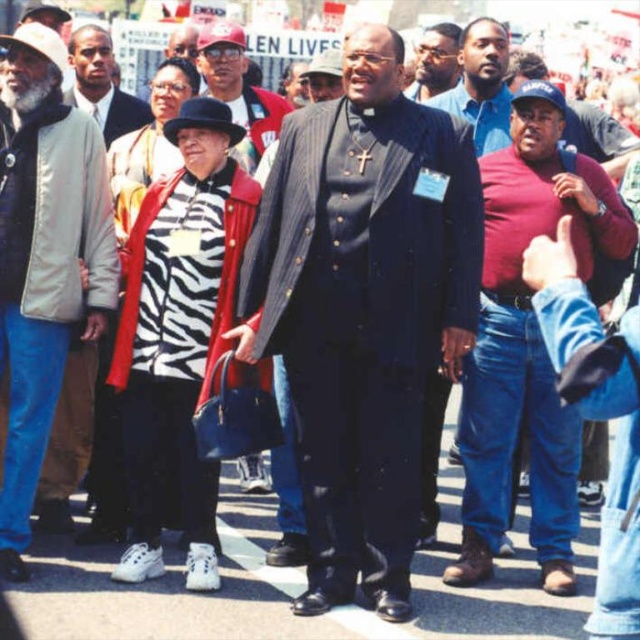
Between matte red shirt at center and light gray jacket at left, which one has less height?

matte red shirt at center

Is matte red shirt at center above light gray jacket at left?

Incorrect, matte red shirt at center is not positioned above light gray jacket at left.

Find the location of a particular element. The width and height of the screenshot is (640, 640). matte red shirt at center is located at coordinates (525, 340).

Can you confirm if matte black suit at center is smaller than light gray jacket at left?

No.

I want to click on matte black suit at center, so click(364, 308).

Measure the distance between point (298,314) and camera.

They are 30.86 meters apart.

Find the location of a particular element. matte black suit at center is located at coordinates [x=364, y=308].

Where is `light gray jacket at left`? light gray jacket at left is located at coordinates (44, 260).

Does light gray jacket at left have a lesser width compared to matte black suit at upper center?

Yes, light gray jacket at left is thinner than matte black suit at upper center.

Image resolution: width=640 pixels, height=640 pixels. What do you see at coordinates (44, 260) in the screenshot? I see `light gray jacket at left` at bounding box center [44, 260].

This screenshot has width=640, height=640. What are the coordinates of `light gray jacket at left` in the screenshot? It's located at (44, 260).